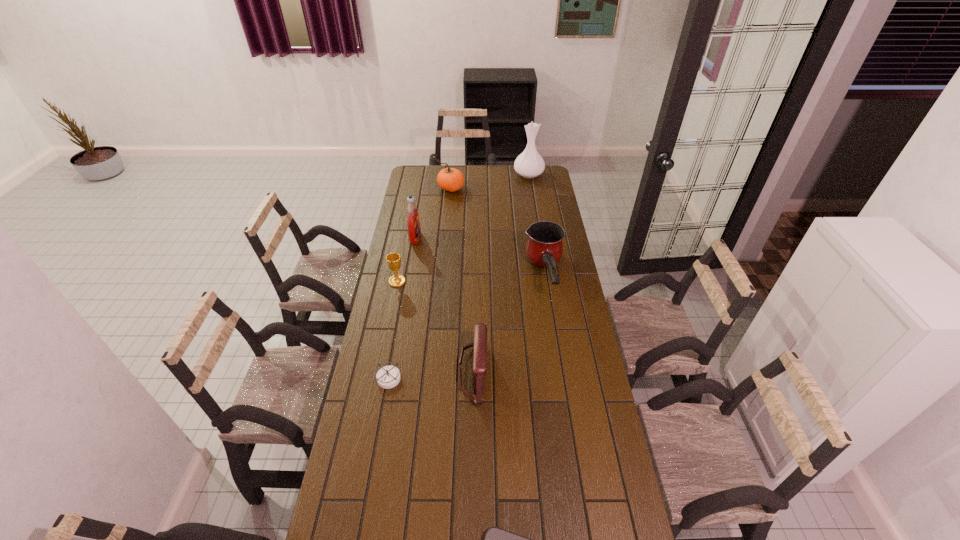
Locate an element on the screen. This screenshot has height=540, width=960. the tallest object is located at coordinates (529, 164).

The image size is (960, 540). I want to click on the sixth nearest object, so click(413, 222).

Image resolution: width=960 pixels, height=540 pixels. What are the coordinates of `the fifth object from right to left` in the screenshot? It's located at (450, 179).

Locate an element on the screen. Image resolution: width=960 pixels, height=540 pixels. the fifth shortest object is located at coordinates (544, 248).

Where is `shoulder bag`? shoulder bag is located at coordinates [x=480, y=330].

Where is `chalice`? This screenshot has width=960, height=540. chalice is located at coordinates (393, 260).

The image size is (960, 540). Identify the location of compass. (387, 377).

In order to click on vacant space situated on the left of the vase in this screenshot , I will do `click(450, 174)`.

Locate an element on the screen. free space located 0.210m on the front surface of the sixth nearest object is located at coordinates (463, 237).

This screenshot has height=540, width=960. What are the coordinates of `vacant space located on the back of the pumpkin` in the screenshot? It's located at (452, 171).